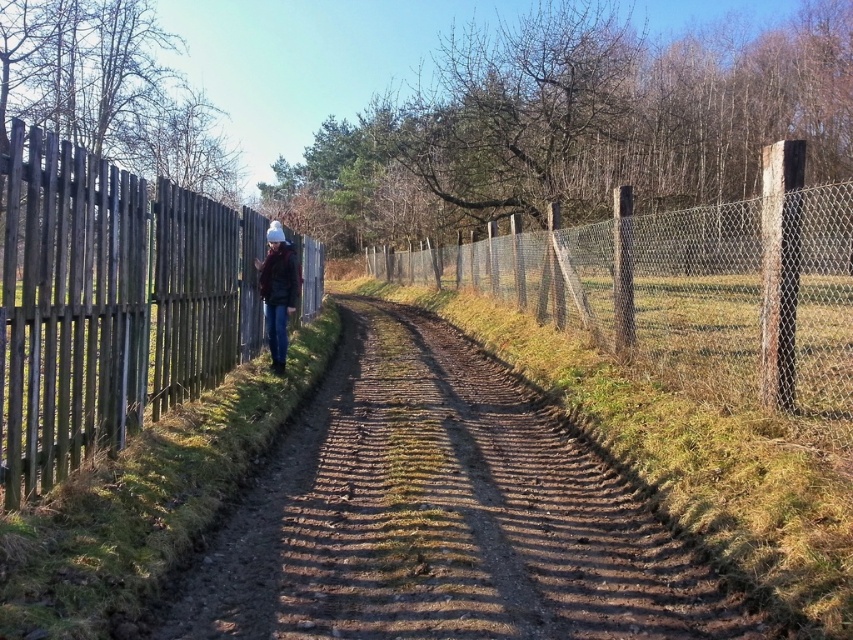
Is wooden planks at left thinner than wire mesh fence at center?

No.

Locate an element on the screen. wooden planks at left is located at coordinates pyautogui.click(x=108, y=304).

Is point (4, 289) positioned before point (633, 266)?

Yes, point (4, 289) is closer to viewer.

Where is `wooden planks at left`? The height and width of the screenshot is (640, 853). wooden planks at left is located at coordinates (108, 304).

Is point (766, 401) farther from camera compared to point (265, 273)?

No.

Between point (490, 240) and point (281, 307), which one is positioned in front?

Point (281, 307)

The height and width of the screenshot is (640, 853). In order to click on wire mesh fence at center in this screenshot , I will do (x=688, y=289).

Which of these two, brown textured dirt track at center or wooden planks at left, stands shorter?

brown textured dirt track at center

From the picture: Is brown textured dirt track at center shorter than wooden planks at left?

Indeed, brown textured dirt track at center has a lesser height compared to wooden planks at left.

The image size is (853, 640). I want to click on brown textured dirt track at center, so click(444, 516).